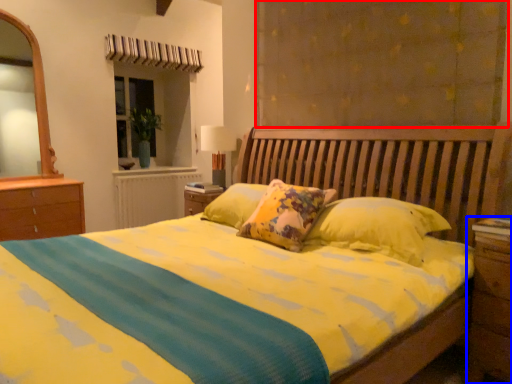
Question: Which point is closer to the camera, curtain (highlighted by a red box) or nightstand (highlighted by a blue box)?

Choices:
 (A) curtain
 (B) nightstand

Answer: (B)